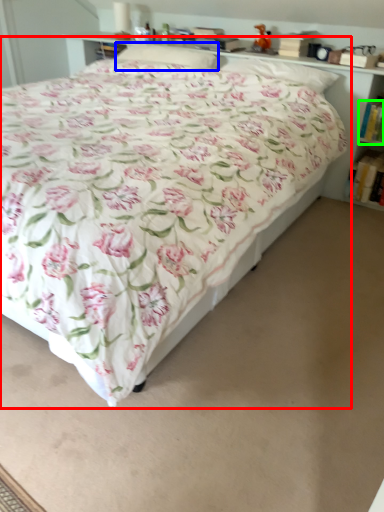
Question: Which is farther away from bed (highlighted by a red box)? pillow (highlighted by a blue box) or book (highlighted by a green box)?

Choices:
 (A) pillow
 (B) book

Answer: (B)